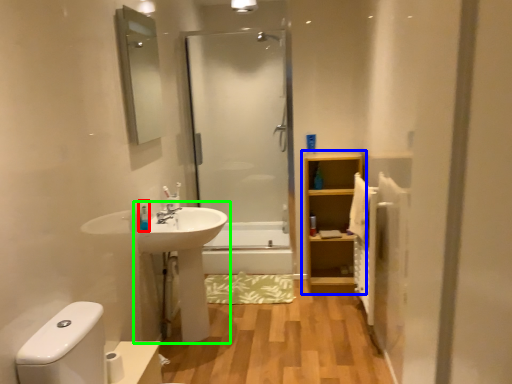
Question: Which object is positioned farthest from toiletry (highlighted by a red box)? Select from bathroom cabinet (highlighted by a blue box) and sink (highlighted by a green box).

Choices:
 (A) bathroom cabinet
 (B) sink

Answer: (A)